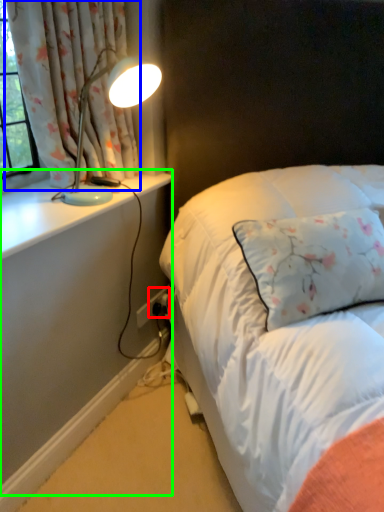
Question: Considering the real-world distances, which object is closest to electric outlet (highlighted by a red box)? curtain (highlighted by a blue box) or dresser (highlighted by a green box).

Choices:
 (A) curtain
 (B) dresser

Answer: (B)